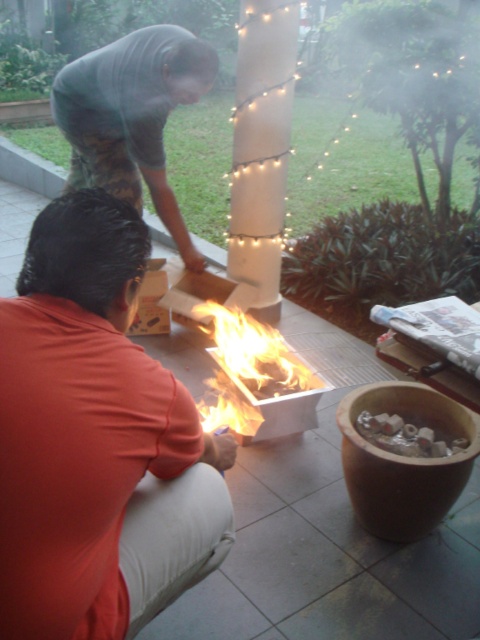
From the picture: Does dark gray shirt at upper left appear over flaming wood at center?

Indeed, dark gray shirt at upper left is positioned over flaming wood at center.

Based on the photo, between dark gray shirt at upper left and flaming wood at center, which one is positioned lower?

flaming wood at center is below.

Where is `dark gray shirt at upper left`? dark gray shirt at upper left is located at coordinates (132, 116).

At what (x,y) coordinates should I click in order to perform the action: click on dark gray shirt at upper left. Please return your answer as a coordinate pair (x, y). The height and width of the screenshot is (640, 480). Looking at the image, I should click on (132, 116).

Based on the photo, who is taller, orange cotton shirt at lower left or flaming wood at center?

orange cotton shirt at lower left

From the picture: Who is positioned more to the left, orange cotton shirt at lower left or flaming wood at center?

orange cotton shirt at lower left

Does point (92, 513) come in front of point (261, 372)?

Yes, it is.

Where is `orange cotton shirt at lower left`? The image size is (480, 640). orange cotton shirt at lower left is located at coordinates (96, 440).

Can you confirm if orange cotton shirt at lower left is shorter than dark gray shirt at upper left?

No.

Does orange cotton shirt at lower left lie behind dark gray shirt at upper left?

No, orange cotton shirt at lower left is in front of dark gray shirt at upper left.

Describe the element at coordinates (96, 440) in the screenshot. I see `orange cotton shirt at lower left` at that location.

Identify the location of orange cotton shirt at lower left. The image size is (480, 640). (96, 440).